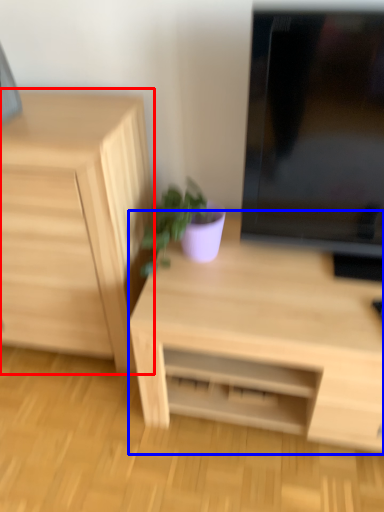
Question: Which of the following is the farthest to the observer, chest of drawers (highlighted by a red box) or desk (highlighted by a blue box)?

Choices:
 (A) chest of drawers
 (B) desk

Answer: (A)